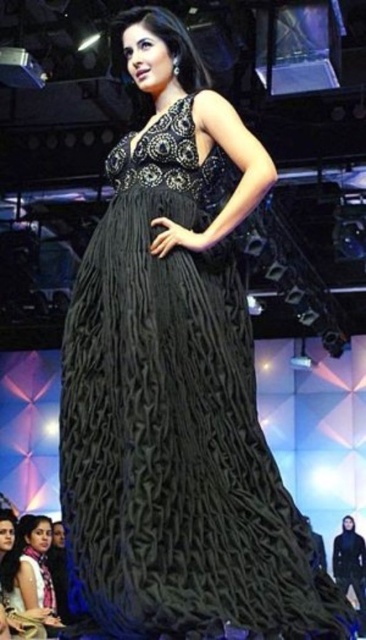
Question: Which of the following is the closest to the observer?

Choices:
 (A) matte black dress at center
 (B) black textured gown at center

Answer: (B)

Question: Which point is closer to the camera?

Choices:
 (A) (234, 541)
 (B) (24, 516)

Answer: (A)

Question: Among these objects, which one is nearest to the camera?

Choices:
 (A) matte black dress at center
 (B) black textured gown at center

Answer: (B)

Question: Does black textured gown at center appear over matte black dress at center?

Choices:
 (A) yes
 (B) no

Answer: (A)

Question: Observing the image, what is the correct spatial positioning of black textured gown at center in reference to matte black dress at center?

Choices:
 (A) left
 (B) right

Answer: (B)

Question: Can you confirm if black textured gown at center is positioned to the left of matte black dress at center?

Choices:
 (A) yes
 (B) no

Answer: (B)